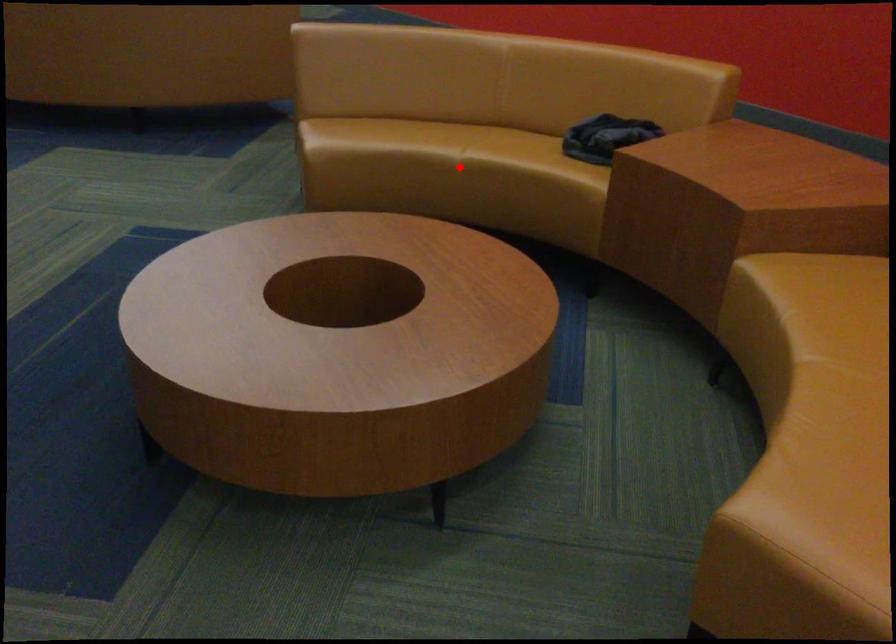
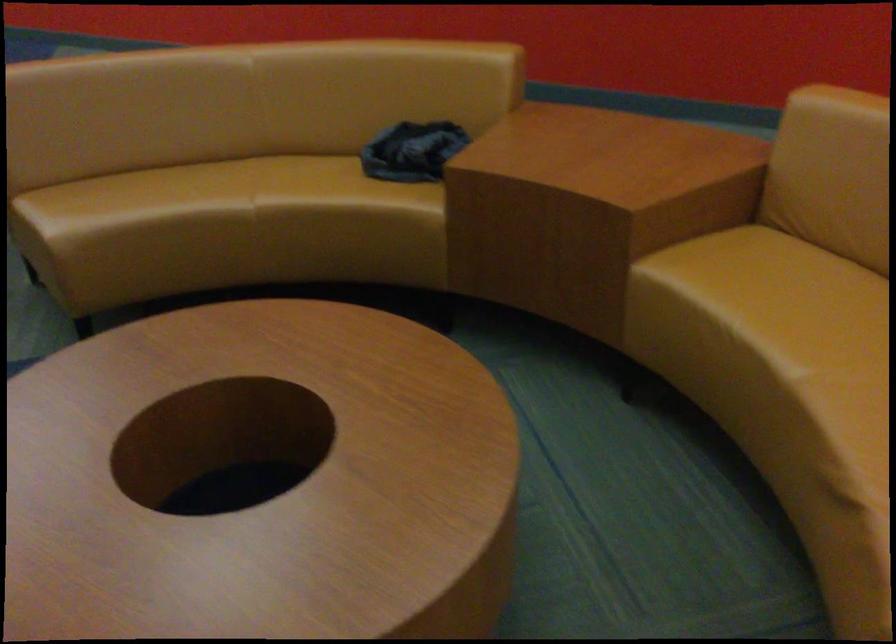
The point at the highlighted location is marked in the first image. Where is the corresponding point in the second image?

(255, 220)